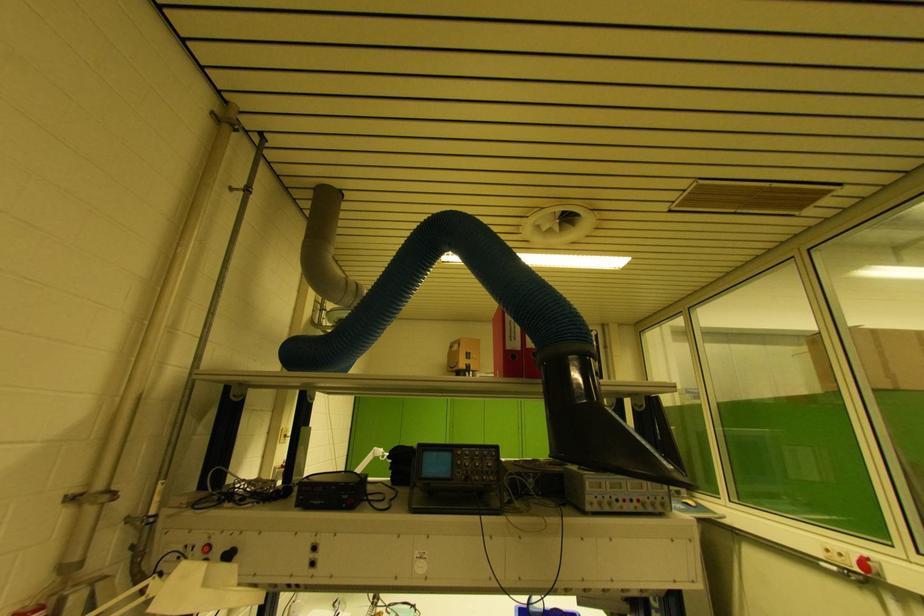
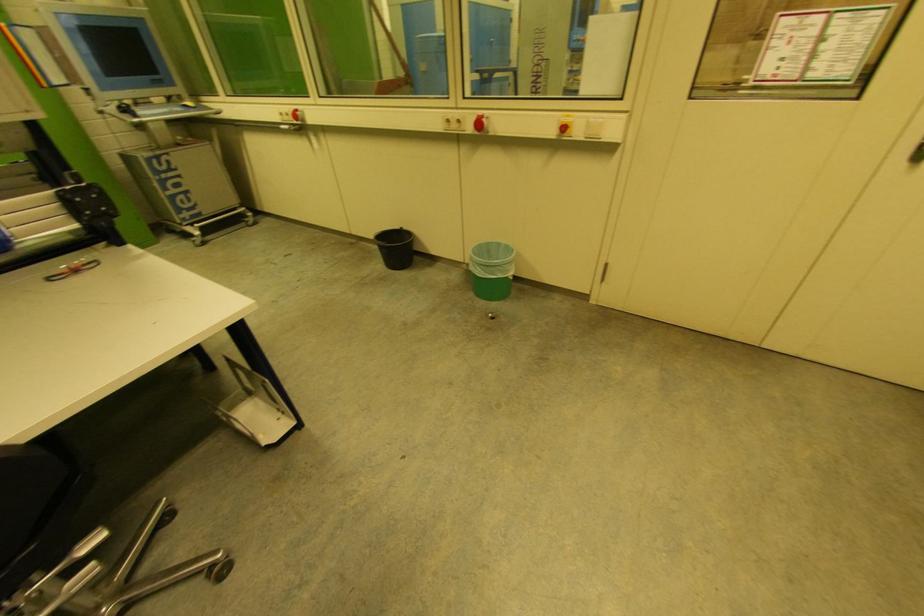
How did the camera likely rotate?

The camera rotated toward right-down.